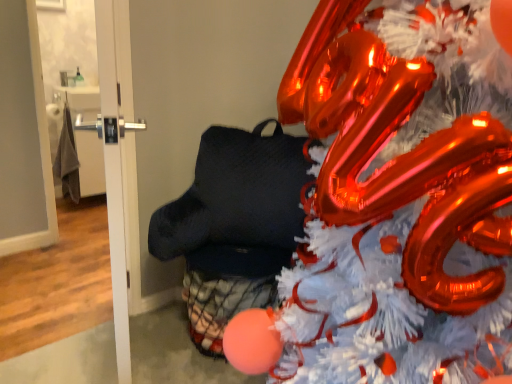
Question: Considering the positions of white glossy door at left, placed as the 2th door when sorted from left to right, and white glossy door at upper left, arranged as the 1th door when viewed from the left, in the image, is white glossy door at left, placed as the 2th door when sorted from left to right, wider or thinner than white glossy door at upper left, arranged as the 1th door when viewed from the left,?

Choices:
 (A) wide
 (B) thin

Answer: (A)

Question: Relative to white glossy door at upper left, arranged as the 1th door when viewed from the left, is white glossy door at left, acting as the 1th door starting from the right, in front or behind?

Choices:
 (A) behind
 (B) front

Answer: (B)

Question: Estimate the real-world distances between objects in this image. Which object is closer to the white glossy door at left, placed as the 2th door when sorted from left to right?

Choices:
 (A) white glossy door at upper left, arranged as the second door when viewed from the right
 (B) shiny metallic christmas tree at center

Answer: (B)

Question: Which of these objects is positioned farthest from the white glossy door at upper left, arranged as the second door when viewed from the right?

Choices:
 (A) shiny metallic christmas tree at center
 (B) white glossy door at left, placed as the 2th door when sorted from left to right

Answer: (A)